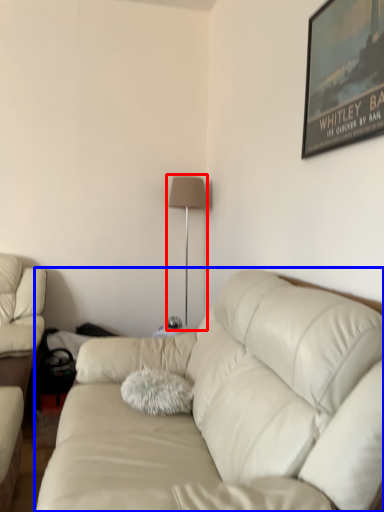
Question: Among these objects, which one is nearest to the camera, table lamp (highlighted by a red box) or studio couch (highlighted by a blue box)?

Choices:
 (A) table lamp
 (B) studio couch

Answer: (B)